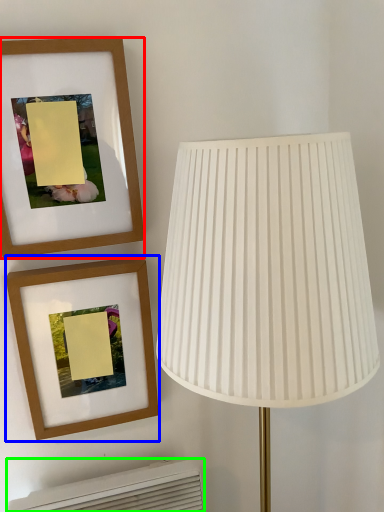
Question: Based on their relative distances, which object is nearer to picture frame (highlighted by a red box)? Choose from picture frame (highlighted by a blue box) and air conditioner (highlighted by a green box).

Choices:
 (A) picture frame
 (B) air conditioner

Answer: (A)